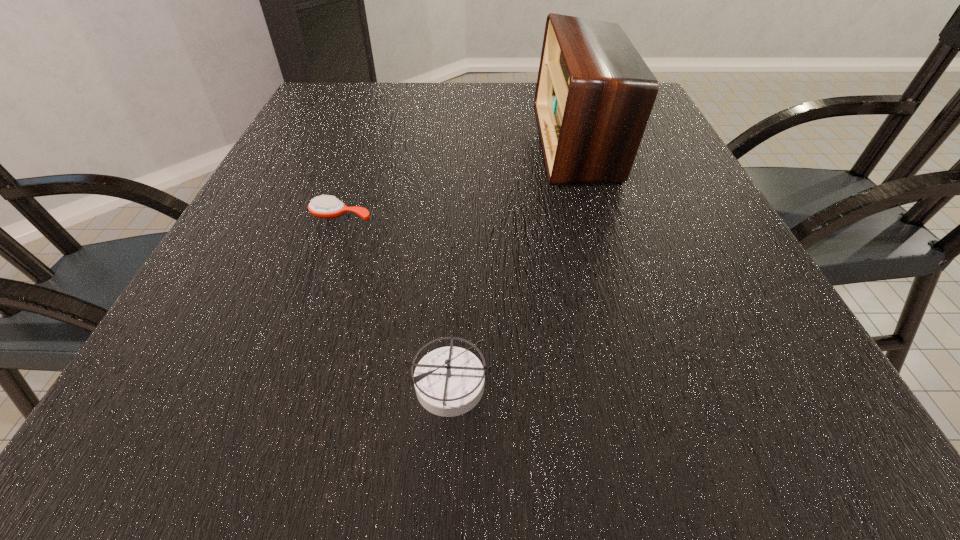
Locate an element on the screen. The width and height of the screenshot is (960, 540). vacant space that's between the rightmost object and the nearest object is located at coordinates (514, 262).

Find the location of a particular element. This screenshot has height=540, width=960. object that can be found as the closest to the second nearest object is located at coordinates (449, 381).

In order to click on object that can be found as the second closest to the second tallest object in this screenshot , I will do `click(594, 95)`.

Where is `free spot that satisfies the following two spatial constraints: 1. on the front-facing side of the farthest object; 2. on the front side of the second nearest object`? free spot that satisfies the following two spatial constraints: 1. on the front-facing side of the farthest object; 2. on the front side of the second nearest object is located at coordinates tap(599, 216).

Find the location of a particular element. The image size is (960, 540). free space that satisfies the following two spatial constraints: 1. on the front-facing side of the radio receiver; 2. on the front side of the second tallest object is located at coordinates pyautogui.click(x=649, y=382).

The height and width of the screenshot is (540, 960). I want to click on free spot that satisfies the following two spatial constraints: 1. on the front side of the shortest object; 2. on the left side of the second tallest object, so click(283, 382).